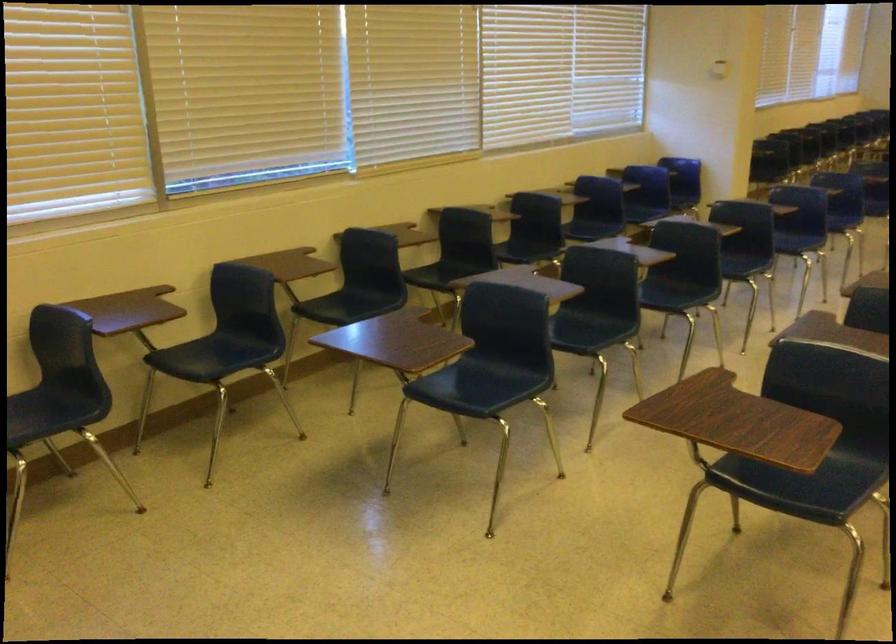
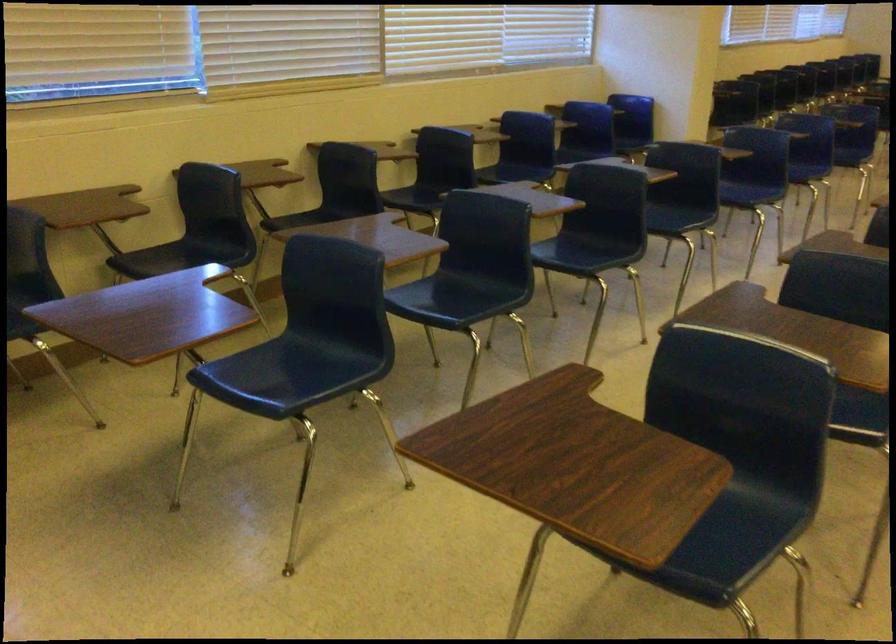
Where in the second image is the point corresponding to pixel 581 324 from the first image?

(462, 292)